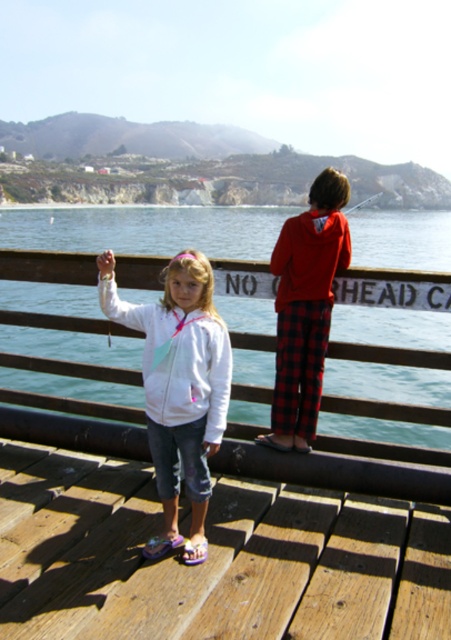
Question: Is blue water at center below red flannel pants at center?

Choices:
 (A) no
 (B) yes

Answer: (A)

Question: Is the position of white fleece jacket at center more distant than that of red flannel pants at center?

Choices:
 (A) no
 (B) yes

Answer: (A)

Question: Is white fleece jacket at center further to the viewer compared to red flannel pants at center?

Choices:
 (A) no
 (B) yes

Answer: (A)

Question: Which object appears farthest from the camera in this image?

Choices:
 (A) red flannel pants at center
 (B) blue water at center

Answer: (B)

Question: Which object is closer to the camera taking this photo?

Choices:
 (A) white fleece jacket at center
 (B) blue water at center
 (C) red flannel pants at center
 (D) wooden at center

Answer: (D)

Question: Among these objects, which one is nearest to the camera?

Choices:
 (A) wooden at center
 (B) red flannel pants at center

Answer: (A)